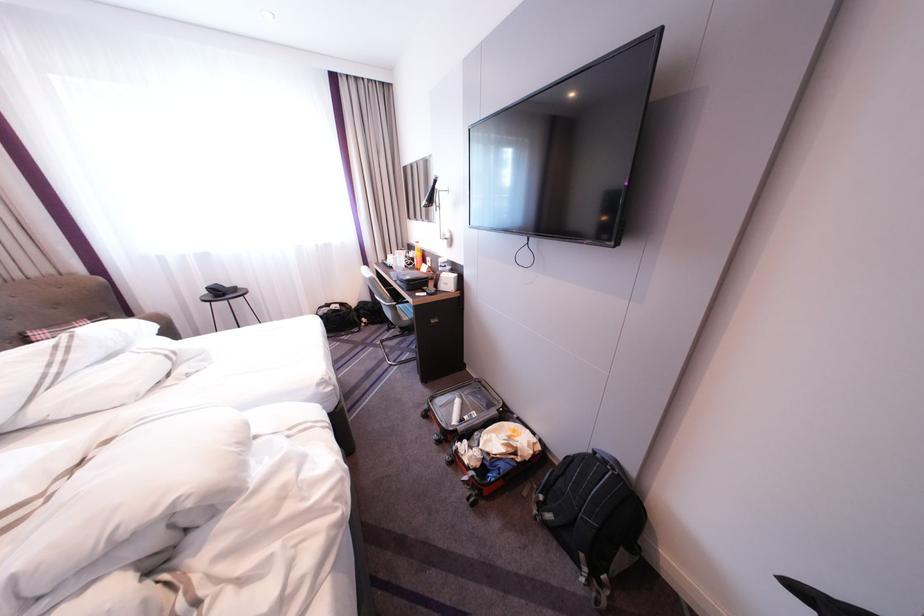
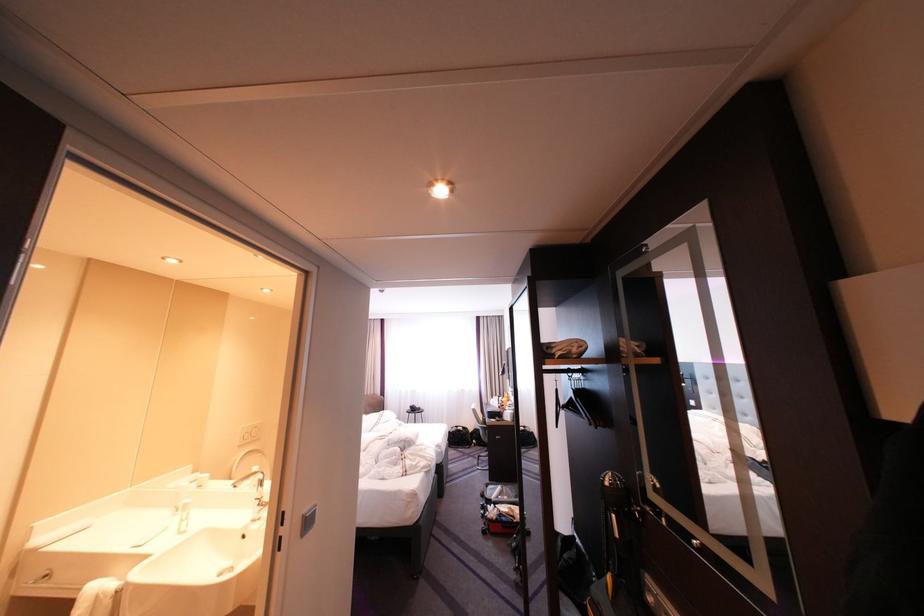
Locate, in the second image, the point that corresponds to the point at 468,431 in the first image.

(503, 501)